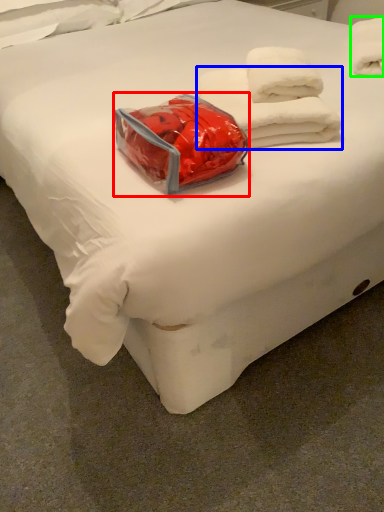
Question: Which object is the closest to the package (highlighted by a red box)? Choose among these: towel (highlighted by a blue box) or towel (highlighted by a green box).

Choices:
 (A) towel
 (B) towel

Answer: (A)